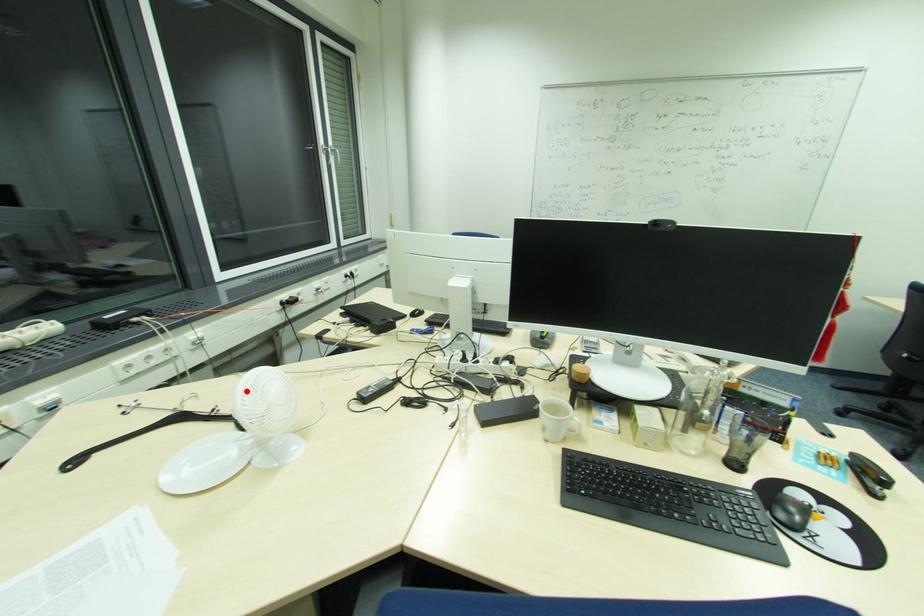
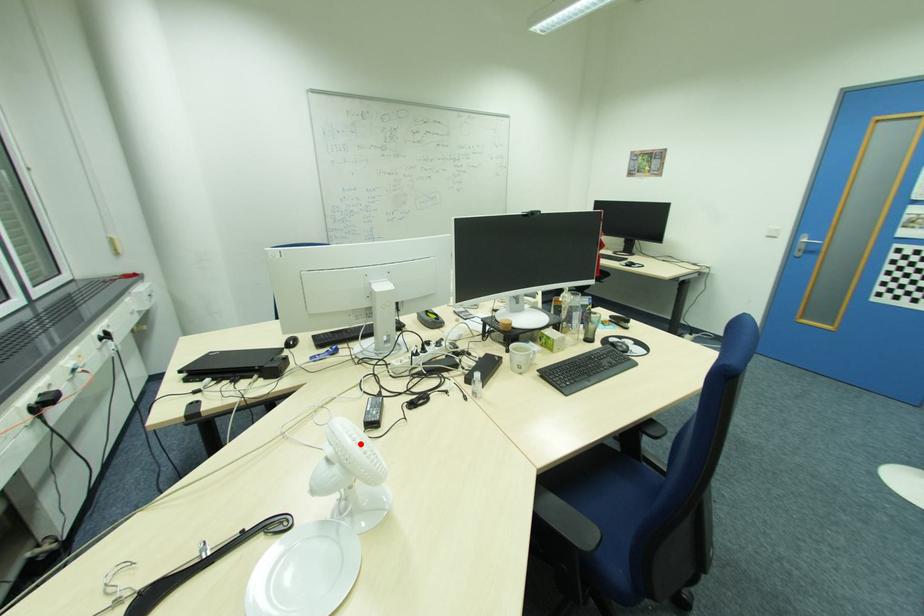
I am providing you with two images of the same scene from different viewpoints. A red point is marked on the first image and another point is marked on the second image. Does the point marked in image1 correspond to the same location as the one in image2?

Yes